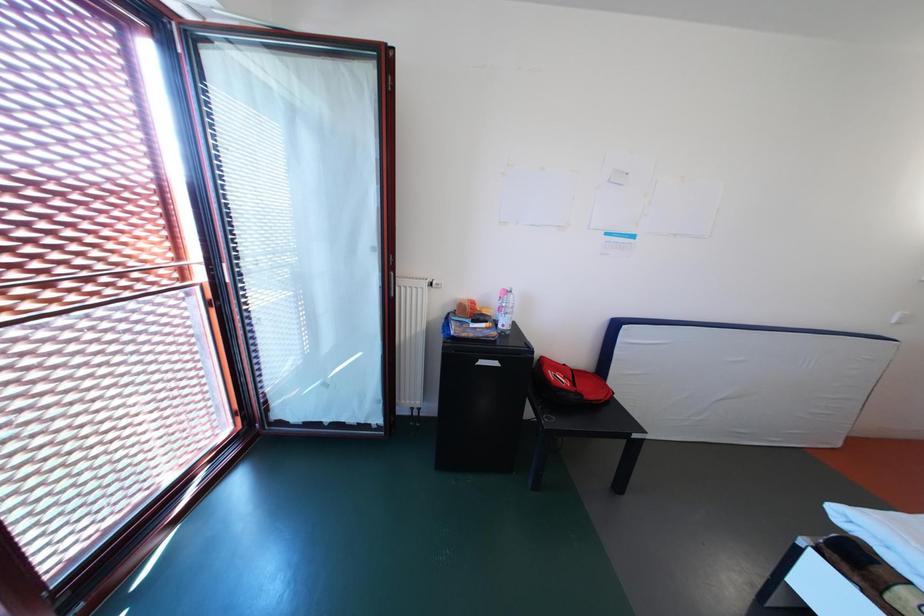
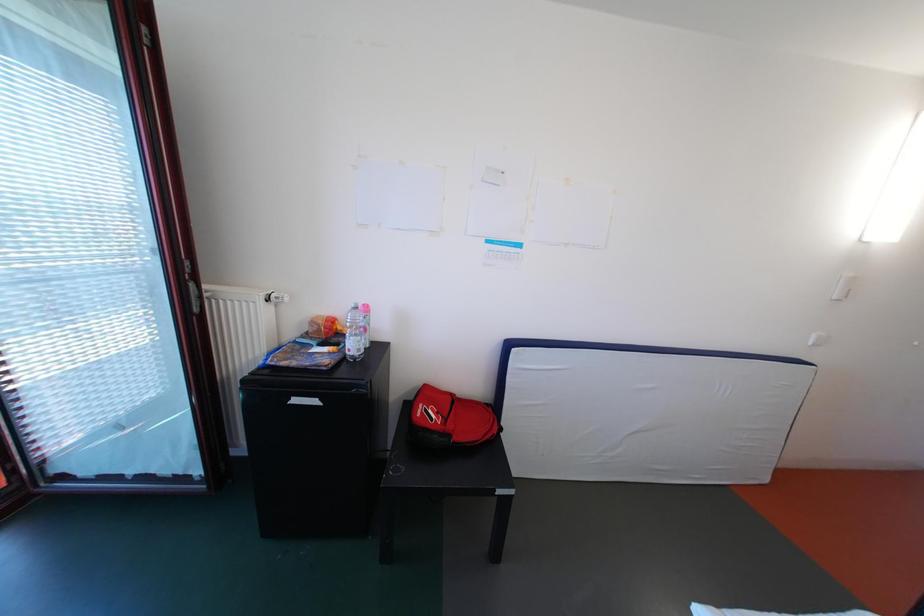
Question: The images are taken continuously from a first-person perspective. In which direction are you moving?

Choices:
 (A) Left
 (B) Right
 (C) Forward
 (D) Backward

Answer: (B)